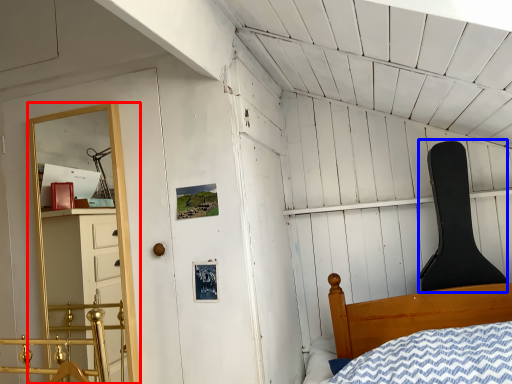
Question: Which of the following is the farthest to the observer, shelf (highlighted by a red box) or chair (highlighted by a blue box)?

Choices:
 (A) shelf
 (B) chair

Answer: (B)